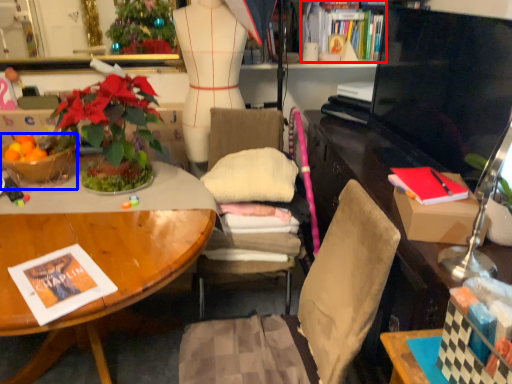
Question: Which object is closer to the camera taking this photo, book (highlighted by a red box) or flowerpot (highlighted by a blue box)?

Choices:
 (A) book
 (B) flowerpot

Answer: (B)